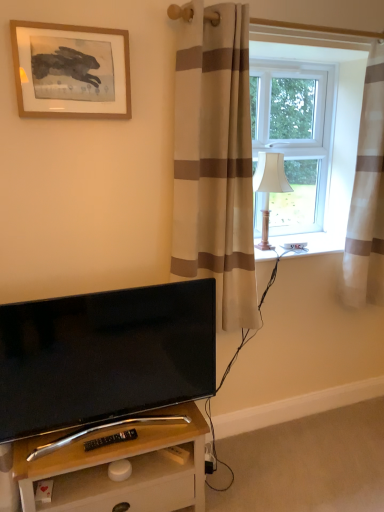
Where is `vacant space underneath white fabric lampshade at right (from a real-world perspective)`? The image size is (384, 512). vacant space underneath white fabric lampshade at right (from a real-world perspective) is located at coordinates click(x=266, y=250).